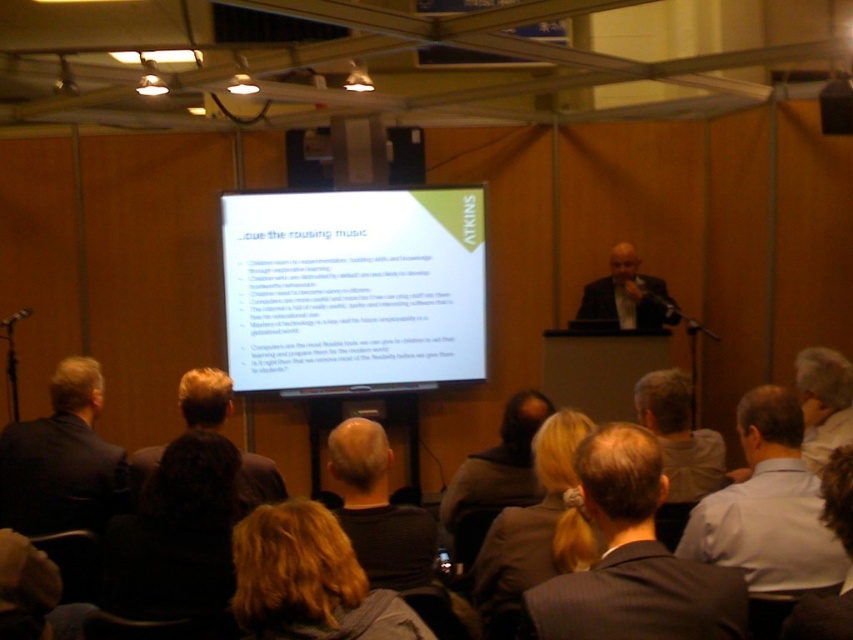
You are standing at the point marked as point (795, 483) and want to reach the podium. The distance between you and the podium is 2.25 meters. If you walk at a speed of 0.5 meters per second, how many seconds will it take you to reach the podium?

The distance between you and the podium is 2.25 meters. Walking at 0.5 meters per second, it will take 2.25 divided by 0.5 equals 4.5 seconds to reach the podium.

You are an attendee at the conference and you want to see both the blonde hair at lower center and the blonde hair at upper center clearly. Which one is located to the left of the other?

The blonde hair at lower center is positioned on the left side of blonde hair at upper center.